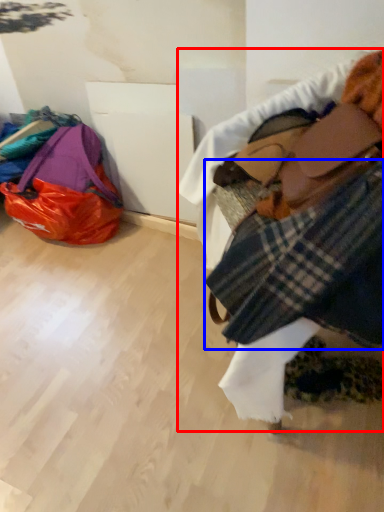
Question: Which of the following is the farthest to the observer, textile (highlighted by a red box) or flannel (highlighted by a blue box)?

Choices:
 (A) textile
 (B) flannel

Answer: (B)